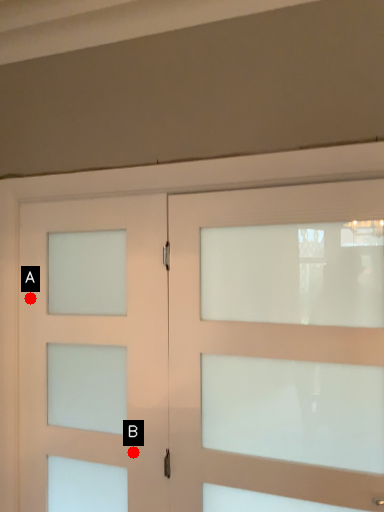
Question: Two points are circled on the image, labeled by A and B beside each circle. Which point appears closest to the camera in this image?

Choices:
 (A) A is closer
 (B) B is closer

Answer: (B)